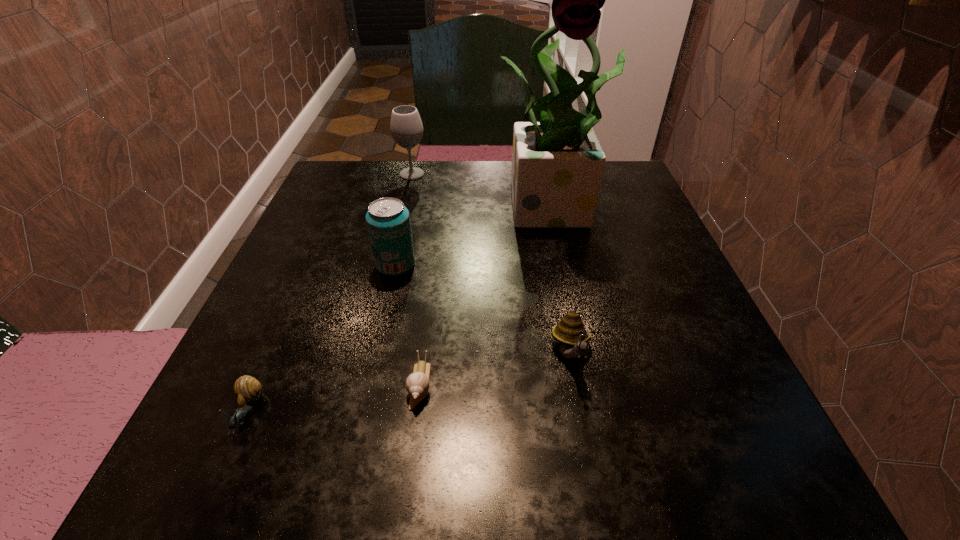
I want to click on object present at the near left corner, so click(247, 389).

This screenshot has width=960, height=540. Find the location of `object at the far right corner`. object at the far right corner is located at coordinates (557, 163).

The width and height of the screenshot is (960, 540). I want to click on vacant space at the far edge of the desktop, so click(x=412, y=200).

Find the location of `vacant region at the left edge`. vacant region at the left edge is located at coordinates click(256, 326).

Image resolution: width=960 pixels, height=540 pixels. I want to click on vacant space at the right edge of the desktop, so pos(630,312).

The height and width of the screenshot is (540, 960). I want to click on vacant space at the far left corner of the desktop, so pos(353,163).

Find the location of a particular element. free area in between the shortest object and the wineglass is located at coordinates (416, 279).

At what (x,y) coordinates should I click in order to perform the action: click on free spot between the wineglass and the flower arrangement. Please return your answer as a coordinate pair (x, y). The image size is (960, 540). Looking at the image, I should click on (484, 190).

You are a GUI agent. You are given a task and a screenshot of the screen. Output one action in this format:
    pyautogui.click(x=<x>, y=<y>)
    Task: Click on the vacant area that lies between the second tallest object and the second escargot from right to left
    This screenshot has width=960, height=540.
    Given the screenshot: What is the action you would take?
    pyautogui.click(x=416, y=279)

In order to click on vacant space in between the third farthest object and the flower arrangement in this screenshot , I will do `click(476, 235)`.